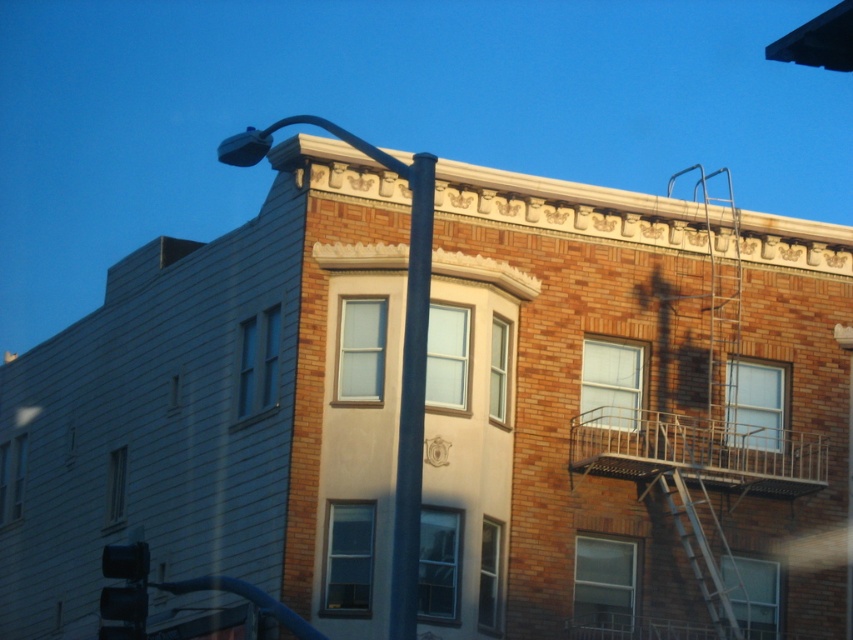
Question: Can you confirm if metallic pole at center is positioned above smooth black pole at center?

Choices:
 (A) no
 (B) yes

Answer: (B)

Question: Is metallic pole at center positioned in front of silver metallic ladder at right?

Choices:
 (A) yes
 (B) no

Answer: (A)

Question: Which of the following is the farthest from the observer?

Choices:
 (A) smooth black pole at center
 (B) metallic pole at center
 (C) black glass traffic light at lower left

Answer: (C)

Question: Can you confirm if silver metallic ladder at right is bigger than black glass traffic light at lower left?

Choices:
 (A) yes
 (B) no

Answer: (B)

Question: Which object is the farthest from the smooth black pole at center?

Choices:
 (A) silver metallic ladder at right
 (B) black glass traffic light at lower left
 (C) metallic pole at center

Answer: (A)

Question: Estimate the real-world distances between objects in this image. Which object is closer to the silver metallic ladder at right?

Choices:
 (A) smooth black pole at center
 (B) black glass traffic light at lower left
 (C) metallic pole at center

Answer: (A)